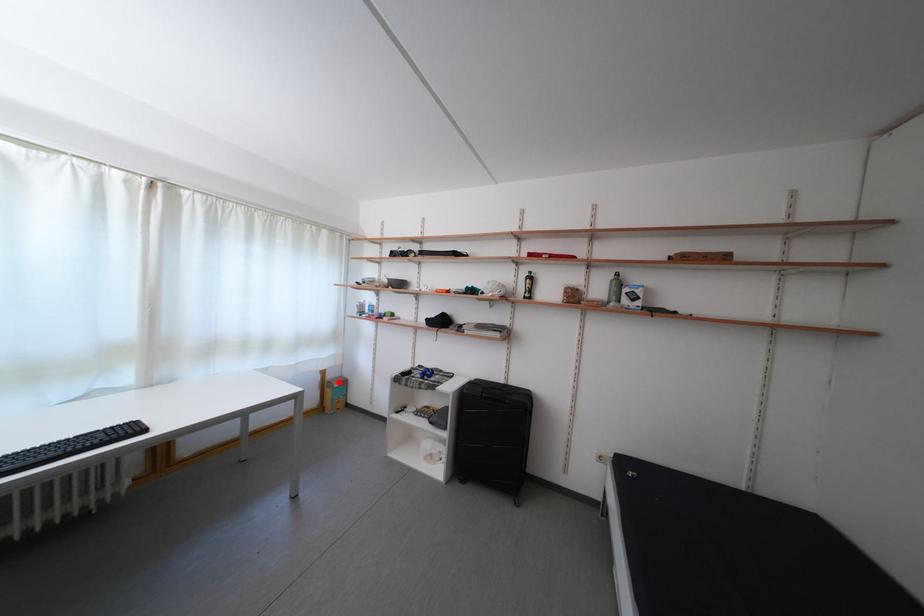
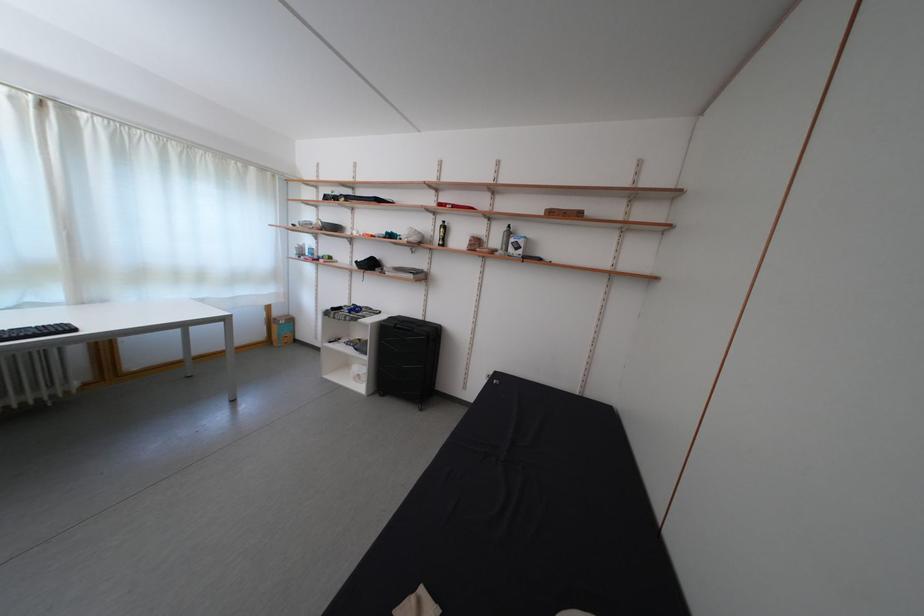
Question: I am providing you with two images of the same scene from different viewpoints. A red point is shown in image1. For the corresponding object point in image2, is it positioned nearer or farther from the camera?

Choices:
 (A) Nearer
 (B) Farther

Answer: (A)